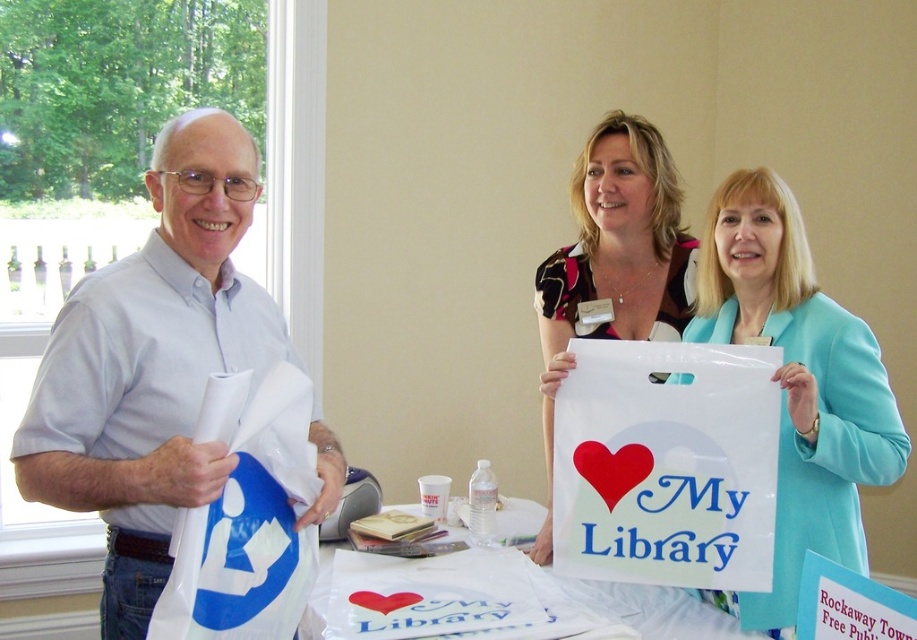
Question: Can you confirm if white matte shirt at left is positioned to the left of white plastic bag at center?

Choices:
 (A) yes
 (B) no

Answer: (A)

Question: Which point is farther to the camera?

Choices:
 (A) (801, 509)
 (B) (148, 525)
 (C) (642, 246)

Answer: (C)

Question: Does white matte shirt at left come in front of white plastic bag at center?

Choices:
 (A) no
 (B) yes

Answer: (B)

Question: Can you confirm if teal fabric jacket at center is thinner than white plastic bag at center?

Choices:
 (A) no
 (B) yes

Answer: (B)

Question: Which point is closer to the camera?

Choices:
 (A) (728, 248)
 (B) (584, 289)
 (C) (688, 636)
 (D) (158, 417)

Answer: (D)

Question: Which point is closer to the camera?

Choices:
 (A) white plastic bag at center
 (B) white matte shirt at left
 (C) teal fabric jacket at center
 (D) printed fabric heart at center

Answer: (B)